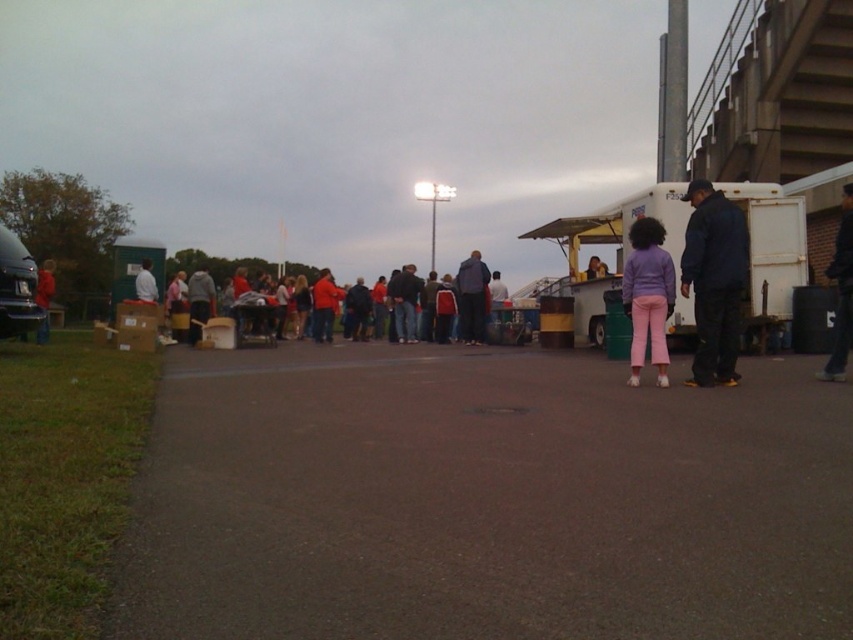
Question: Does purple fleece jacket at center appear on the right side of red fabric crowd at center?

Choices:
 (A) yes
 (B) no

Answer: (A)

Question: Which point appears farthest from the camera in this image?

Choices:
 (A) (160, 262)
 (B) (621, 292)

Answer: (A)

Question: Considering the relative positions of purple fleece jacket at center and matte red jacket at center in the image provided, where is purple fleece jacket at center located with respect to matte red jacket at center?

Choices:
 (A) right
 (B) left

Answer: (A)

Question: Is purple fleece jacket at center to the right of white matte shirt at center from the viewer's perspective?

Choices:
 (A) no
 (B) yes

Answer: (B)

Question: Estimate the real-world distances between objects in this image. Which object is farther from the dark blue jacket at right?

Choices:
 (A) gray hoodie at center
 (B) purple fleece jacket at center
 (C) white matte shirt at center

Answer: (A)

Question: Which of the following is the closest to the observer?

Choices:
 (A) matte red jacket at center
 (B) dark gray jacket at center
 (C) dark blue jeans at center

Answer: (B)